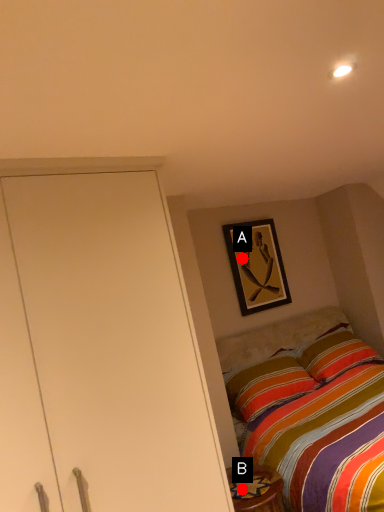
Question: Two points are circled on the image, labeled by A and B beside each circle. Which point is farther from the camera taking this photo?

Choices:
 (A) A is further
 (B) B is further

Answer: (A)